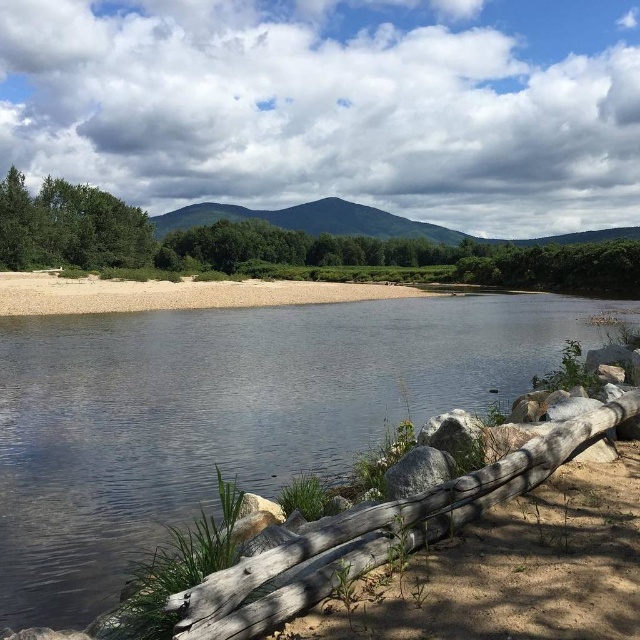
Does brown sand at lower center have a lesser height compared to green matte tree at left?

Indeed, brown sand at lower center has a lesser height compared to green matte tree at left.

You are a GUI agent. You are given a task and a screenshot of the screen. Output one action in this format:
    pyautogui.click(x=<x>, y=<y>)
    Task: Click on the brown sand at lower center
    The image size is (640, 640).
    Given the screenshot: What is the action you would take?
    pyautogui.click(x=176, y=292)

Consider the image. Is green leafy tree at left wider than brown sand at lower center?

Indeed, green leafy tree at left has a greater width compared to brown sand at lower center.

Find the location of a particular element. green leafy tree at left is located at coordinates pos(282,246).

Is clear water at center closer to camera compared to green leafy tree at left?

That is True.

Between clear water at center and green leafy tree at left, which one appears on the right side from the viewer's perspective?

From the viewer's perspective, green leafy tree at left appears more on the right side.

Is point (104, 512) more distant than point (148, 230)?

No, it is not.

This screenshot has width=640, height=640. What are the coordinates of `clear water at center` in the screenshot? It's located at (227, 413).